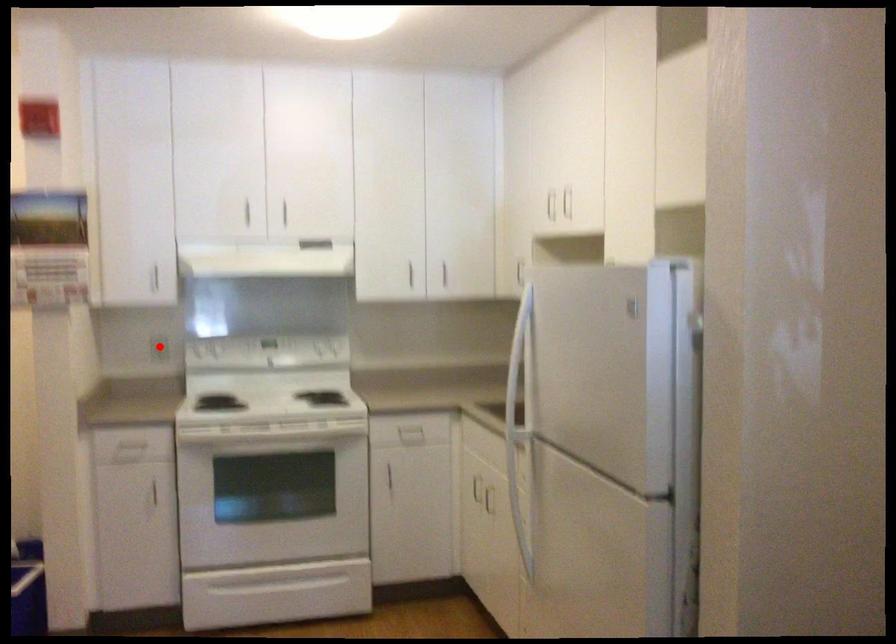
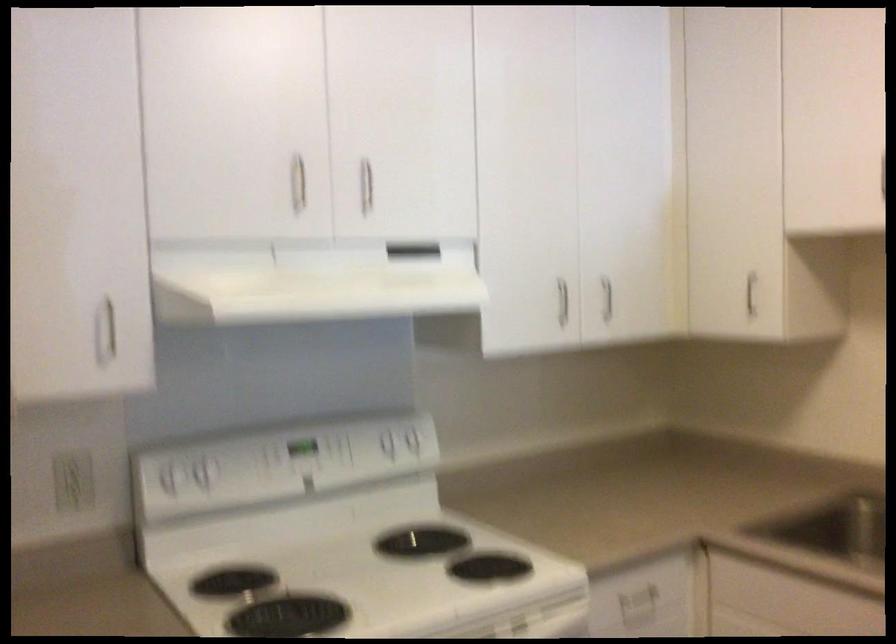
Question: A red point is marked in image1. In image2, is the corresponding 3D point closer to the camera or farther? Reply with the corresponding letter.

Choices:
 (A) The corresponding 3D point is closer.
 (B) The corresponding 3D point is farther.

Answer: (A)